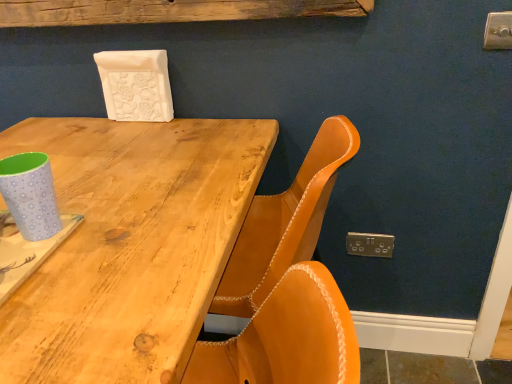
Question: Based on their positions, is rustic wood plank at upper center located to the left or right of light blue polka dot paper cup at left?

Choices:
 (A) right
 (B) left

Answer: (A)

Question: Based on their sizes in the image, would you say rustic wood plank at upper center is bigger or smaller than light blue polka dot paper cup at left?

Choices:
 (A) small
 (B) big

Answer: (B)

Question: Estimate the real-world distances between objects in this image. Which object is closer to the natural wood table at center?

Choices:
 (A) gold metallic electric outlet at lower right
 (B) light blue polka dot paper cup at left
 (C) rustic wood plank at upper center

Answer: (B)

Question: Estimate the real-world distances between objects in this image. Which object is farther from the natural wood table at center?

Choices:
 (A) light blue polka dot paper cup at left
 (B) rustic wood plank at upper center
 (C) gold metallic electric outlet at lower right

Answer: (C)